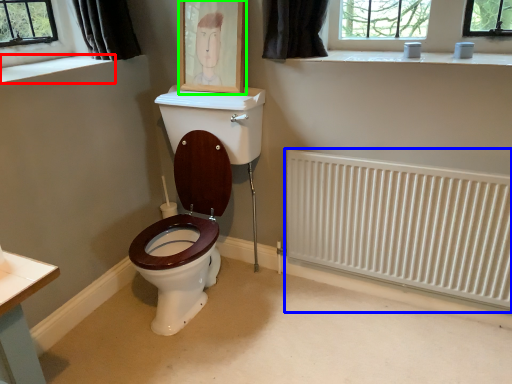
Question: Based on their relative distances, which object is farther from window sill (highlighted by a red box)? Choose from radiator (highlighted by a blue box) and picture frame (highlighted by a green box).

Choices:
 (A) radiator
 (B) picture frame

Answer: (A)